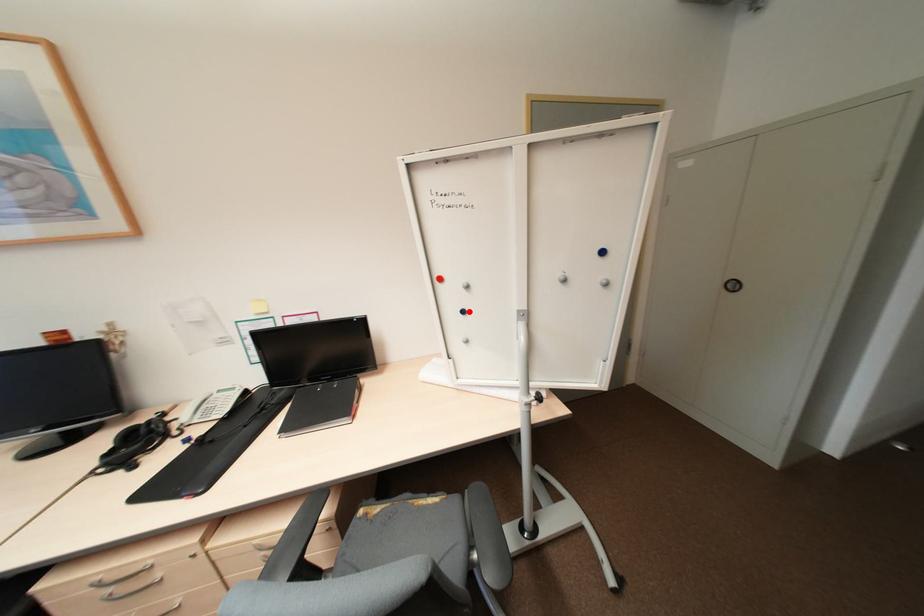
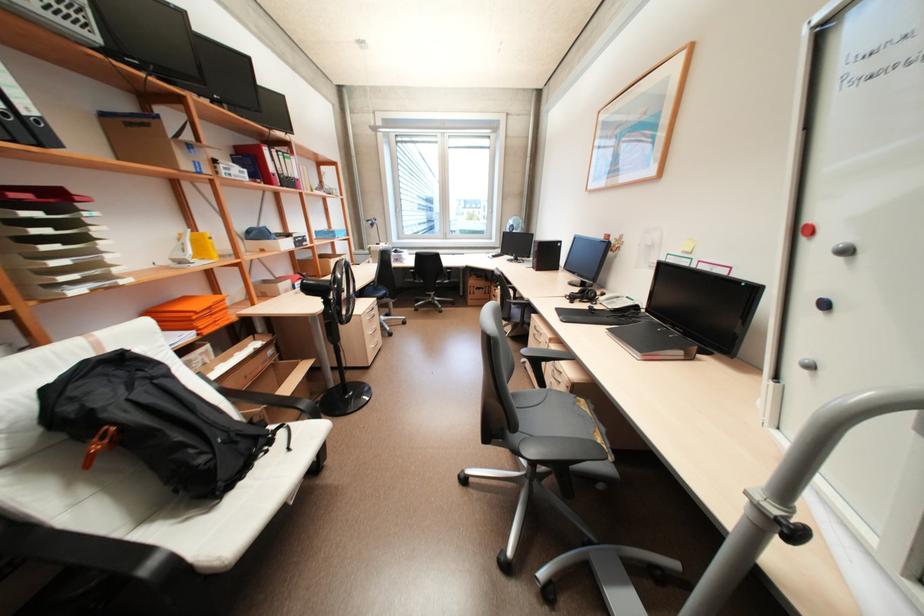
Locate, in the second image, the point that corresponds to the highlighted location in the first image.

(830, 304)